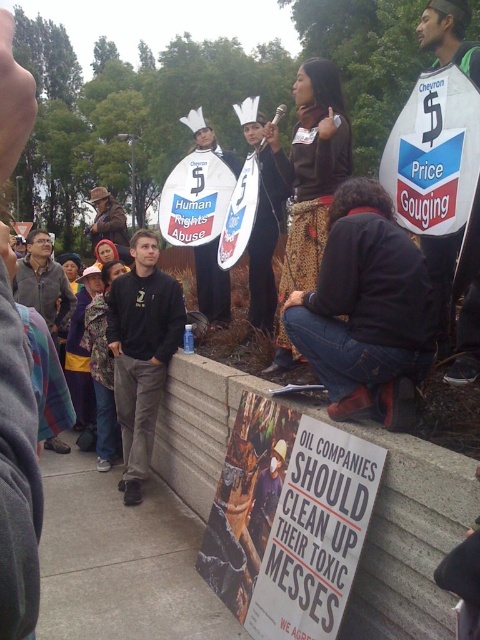
Question: Based on their relative distances, which object is farther from the dark gray jacket at center?

Choices:
 (A) leopard print jacket at lower center
 (B) white plastic sign at upper right
 (C) matte paper poster at center

Answer: (B)

Question: Is white paper crown at center smaller than brown leather jacket at upper left?

Choices:
 (A) yes
 (B) no

Answer: (A)

Question: Considering the real-world distances, which object is closest to the black cotton sweatshirt at center?

Choices:
 (A) matte paper poster at center
 (B) brown leather jacket at upper left
 (C) leopard print jacket at lower center
 (D) white paper crown at center

Answer: (D)

Question: Considering the real-world distances, which object is farthest from the brown leather jacket at upper left?

Choices:
 (A) matte paper poster at center
 (B) black cotton sweatshirt at center

Answer: (A)

Question: Considering the relative positions of matte paper poster at center and white plastic sign at upper right in the image provided, where is matte paper poster at center located with respect to white plastic sign at upper right?

Choices:
 (A) below
 (B) above

Answer: (A)

Question: Is matte paper poster at center above white paper crown at center?

Choices:
 (A) yes
 (B) no

Answer: (B)